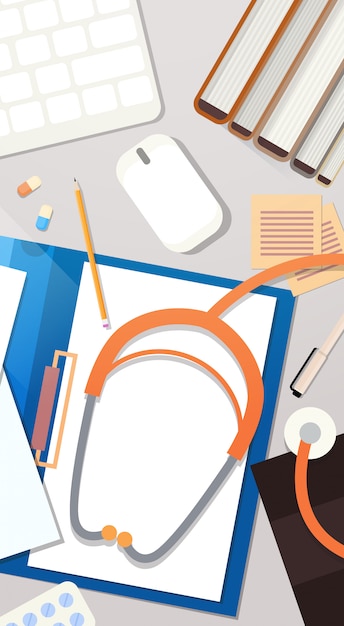
This screenshot has width=344, height=626. I want to click on book, so click(x=223, y=96), click(x=257, y=109), click(x=283, y=125), click(x=313, y=141), click(x=336, y=160).